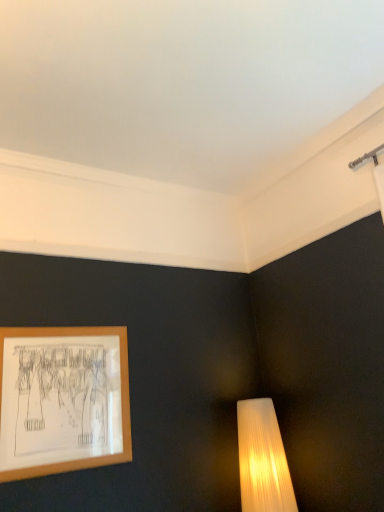
What do you see at coordinates (63, 400) in the screenshot? The width and height of the screenshot is (384, 512). I see `wooden frame at lower left` at bounding box center [63, 400].

Locate an element on the screen. The image size is (384, 512). wooden frame at lower left is located at coordinates (63, 400).

Identify the location of wooden frame at lower left. (63, 400).